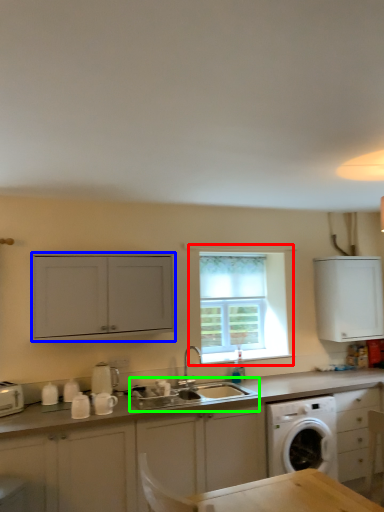
Question: Based on their relative distances, which object is farther from window (highlighted by a red box)? Choose from cabinetry (highlighted by a blue box) and sink (highlighted by a green box).

Choices:
 (A) cabinetry
 (B) sink

Answer: (A)